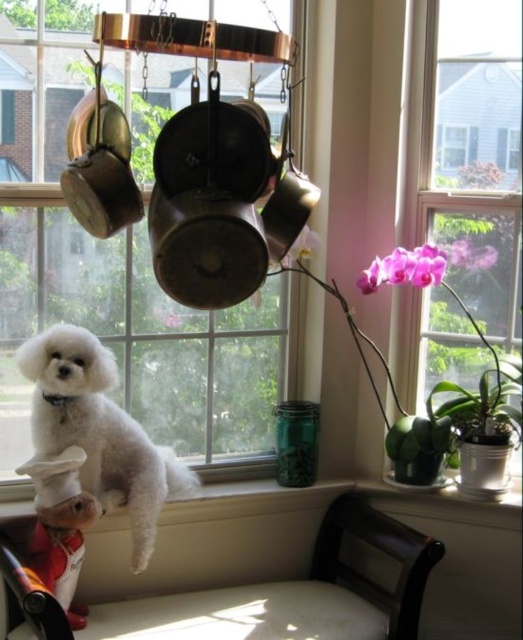
You are a photographer setting up a camera to capture the white fluffy dog at center and the matte red chef hat at lower left. Given that the camera lens can only focus on objects wider than 10 inches, can both objects be in focus simultaneously?

The white fluffy dog at center is wider than the matte red chef hat at lower left. Since the camera lens requires objects wider than 10 inches to focus, the dog likely meets the requirement, but the chef hat may not. However, without knowing the exact widths, we can only confirm the dog is wider than the hat. If the hat is under 10 inches, it might not focus properly.

You are standing in the kitchen and want to place a new potted plant exactly where the white fluffy dog at center is currently sitting. Is this possible without moving the dog?

The white fluffy dog at center is positioned at coordinates point (99,429), so placing a new potted plant there would require moving the dog as it is currently occupying that space.